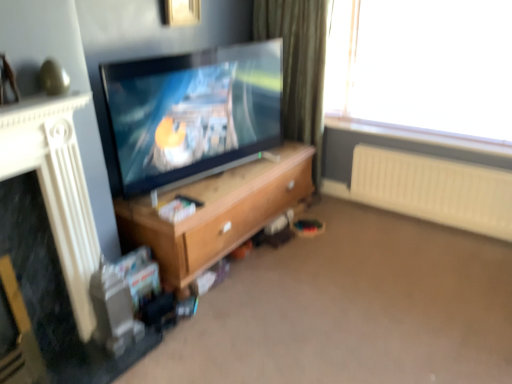
This screenshot has height=384, width=512. What do you see at coordinates (217, 212) in the screenshot?
I see `wooden cabinet at center` at bounding box center [217, 212].

Describe the element at coordinates (434, 189) in the screenshot. Image resolution: width=512 pixels, height=384 pixels. I see `white plastic radiator at right` at that location.

From the picture: Measure the distance between point (142,59) and camera.

Point (142,59) and camera are 2.47 meters apart from each other.

In order to face wooden tv stand at center, should I rotate leftwards or rightwards?

To face it directly, rotate right by 9.221 degrees.

Locate an element on the screen. The height and width of the screenshot is (384, 512). green fabric curtain at upper right is located at coordinates 298,66.

From the image's perspective, between green fabric curtain at upper right and matte black tv at center, which one is located above?

green fabric curtain at upper right is shown above in the image.

Does green fabric curtain at upper right come behind matte black tv at center?

Yes, it is behind matte black tv at center.

How different are the orientations of green fabric curtain at upper right and matte black tv at center in degrees?

They differ by 77 degrees in their facing directions.

Is green fabric curtain at upper right wider or thinner than matte black tv at center?

In the image, green fabric curtain at upper right appears to be wider than matte black tv at center.

Considering the relative sizes of matte black tv at center and wooden tv stand at center in the image provided, is matte black tv at center shorter than wooden tv stand at center?

No.

From a real-world perspective, between matte black tv at center and wooden tv stand at center, who is vertically higher?

matte black tv at center, from a real-world perspective.

Does matte black tv at center have a smaller size compared to wooden tv stand at center?

Yes.

From a real-world perspective, between metallic gold picture frame at upper center and green fabric curtain at upper right, who is vertically higher?

metallic gold picture frame at upper center is physically above.

Does metallic gold picture frame at upper center turn towards green fabric curtain at upper right?

No, metallic gold picture frame at upper center is not facing towards green fabric curtain at upper right.

Considering the relative sizes of metallic gold picture frame at upper center and green fabric curtain at upper right in the image provided, is metallic gold picture frame at upper center wider than green fabric curtain at upper right?

In fact, metallic gold picture frame at upper center might be narrower than green fabric curtain at upper right.

Looking at this image, which object is closer to the camera, white textured fireplace at left or metallic gold picture frame at upper center?

white textured fireplace at left is more forward.

Identify the location of fireplace located on the left of metallic gold picture frame at upper center. The image size is (512, 384). (56, 187).

Is there a large distance between white textured fireplace at left and metallic gold picture frame at upper center?

Yes.

From the image's perspective, which is above, white textured fireplace at left or metallic gold picture frame at upper center?

metallic gold picture frame at upper center is shown above in the image.

Is wooden cabinet at center bigger than white plastic radiator at right?

Yes.

Between point (195, 272) and point (483, 174), which one is positioned behind?

The point (483, 174) is farther from the camera.

Is wooden cabinet at center looking in the opposite direction of white plastic radiator at right?

That's not correct — wooden cabinet at center is not looking away from white plastic radiator at right.

Could you tell me if white plastic radiator at right is turned towards green fabric curtain at upper right?

No.

How different are the orientations of white plastic radiator at right and green fabric curtain at upper right in degrees?

There is a 0.707-degree angle between the facing directions of white plastic radiator at right and green fabric curtain at upper right.

Looking at their sizes, would you say white plastic radiator at right is wider or thinner than green fabric curtain at upper right?

Clearly, white plastic radiator at right has less width compared to green fabric curtain at upper right.

Consider the image. From a real-world perspective, which object rests below the other?

From a 3D spatial view, white plastic radiator at right is below.

Is wooden tv stand at center aimed at white textured fireplace at left?

No.

Find the location of a particular element. fireplace behind the wooden tv stand at center is located at coordinates (56, 187).

Is white textured fireplace at left inside wooden tv stand at center?

No.

How different are the orientations of wooden tv stand at center and white textured fireplace at left in degrees?

The angular difference between wooden tv stand at center and white textured fireplace at left is 92.2 degrees.

This screenshot has width=512, height=384. I want to click on television positioned vertically above the green fabric curtain at upper right (from a real-world perspective), so click(193, 113).

Locate an element on the screen. The image size is (512, 384). television located on the left of wooden tv stand at center is located at coordinates (193, 113).

Estimate the real-world distances between objects in this image. Which object is closer to wooden cabinet at center, white plastic radiator at right or metallic gold picture frame at upper center?

white plastic radiator at right is closer to wooden cabinet at center.

Based on their spatial positions, is white textured fireplace at left or wooden tv stand at center closer to metallic gold picture frame at upper center?

white textured fireplace at left lies closer to metallic gold picture frame at upper center than the other object.

Looking at the image, which one is located closer to matte black tv at center, wooden cabinet at center or white plastic radiator at right?

wooden cabinet at center is closer to matte black tv at center.

Based on their spatial positions, is white plastic radiator at right or wooden tv stand at center further from wooden cabinet at center?

The object further to wooden cabinet at center is white plastic radiator at right.

Which object lies further to the anchor point wooden tv stand at center, metallic gold picture frame at upper center or green fabric curtain at upper right?

The object further to wooden tv stand at center is metallic gold picture frame at upper center.

Looking at the image, which one is located closer to white textured fireplace at left, wooden cabinet at center or matte black tv at center?

The object closer to white textured fireplace at left is wooden cabinet at center.

Considering their positions, is wooden cabinet at center positioned closer to wooden tv stand at center than white plastic radiator at right?

wooden cabinet at center.

When comparing their distances from wooden cabinet at center, does green fabric curtain at upper right or matte black tv at center seem closer?

matte black tv at center is closer to wooden cabinet at center.

Locate an element on the screen. The image size is (512, 384). cabinetry between wooden tv stand at center and white plastic radiator at right along the z-axis is located at coordinates (217, 212).

You are a GUI agent. You are given a task and a screenshot of the screen. Output one action in this format:
    pyautogui.click(x=<x>, y=<y>)
    Task: Click on the television between wooden tv stand at center and white plastic radiator at right from front to back
    Image resolution: width=512 pixels, height=384 pixels.
    Given the screenshot: What is the action you would take?
    pyautogui.click(x=193, y=113)

Where is `picture frame located between wooden tv stand at center and green fabric curtain at upper right in the depth direction`? The image size is (512, 384). picture frame located between wooden tv stand at center and green fabric curtain at upper right in the depth direction is located at coordinates (179, 12).

Find the location of a particular element. television situated between metallic gold picture frame at upper center and white plastic radiator at right from left to right is located at coordinates (193, 113).